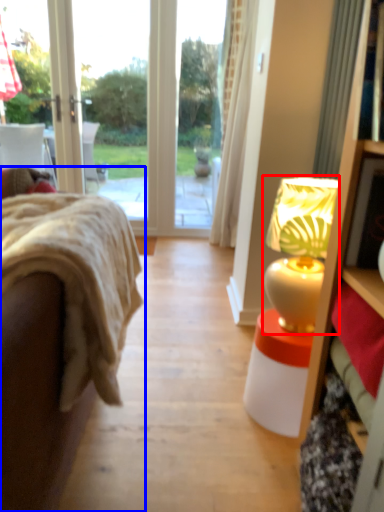
Question: Among these objects, which one is farthest to the camera, table lamp (highlighted by a red box) or studio couch (highlighted by a blue box)?

Choices:
 (A) table lamp
 (B) studio couch

Answer: (A)